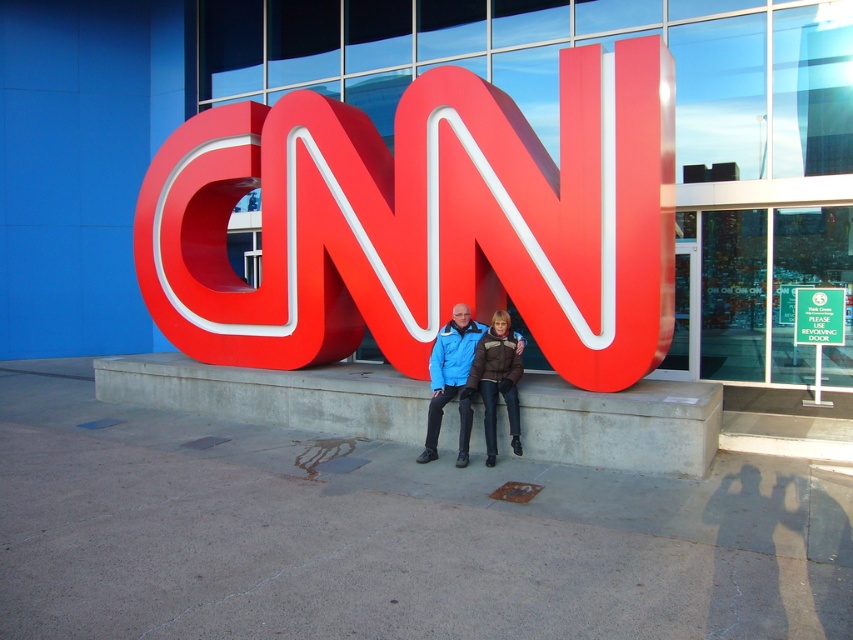
Question: Which of the following is the closest to the observer?

Choices:
 (A) (453, 333)
 (B) (811, 317)

Answer: (A)

Question: Can you confirm if matte blue jacket at center is positioned above green plastic sign at center?

Choices:
 (A) no
 (B) yes

Answer: (A)

Question: Does shiny plastic letter at center have a larger size compared to matte blue jacket at center?

Choices:
 (A) no
 (B) yes

Answer: (A)

Question: Does matte blue jacket at center lie in front of green plastic sign at center?

Choices:
 (A) no
 (B) yes

Answer: (B)

Question: Which point is closer to the camera?

Choices:
 (A) matte blue jacket at center
 (B) shiny plastic letter at center
 (C) green plastic sign at center

Answer: (A)

Question: Among these points, which one is farthest from the camera?

Choices:
 (A) (438, 412)
 (B) (801, 300)
 (C) (427, 324)

Answer: (B)